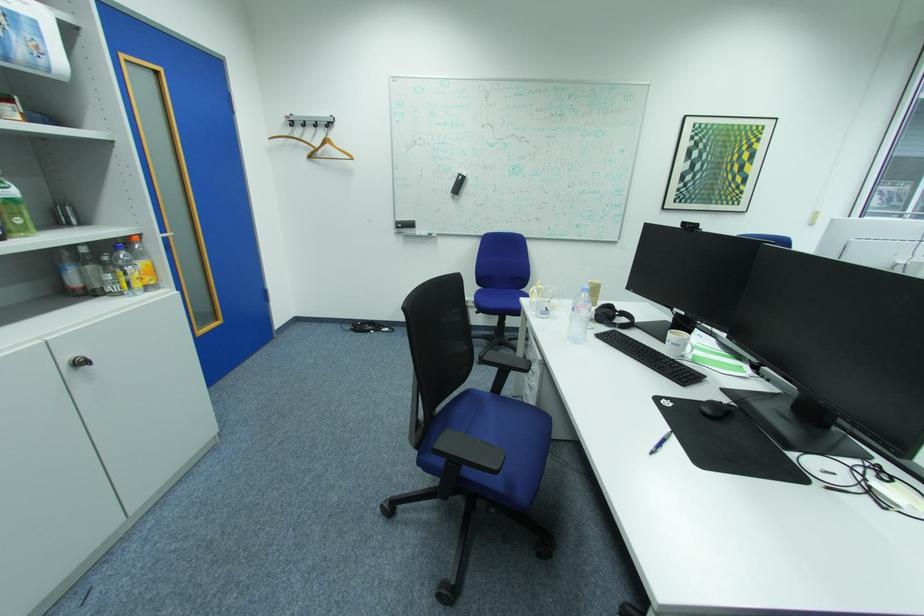
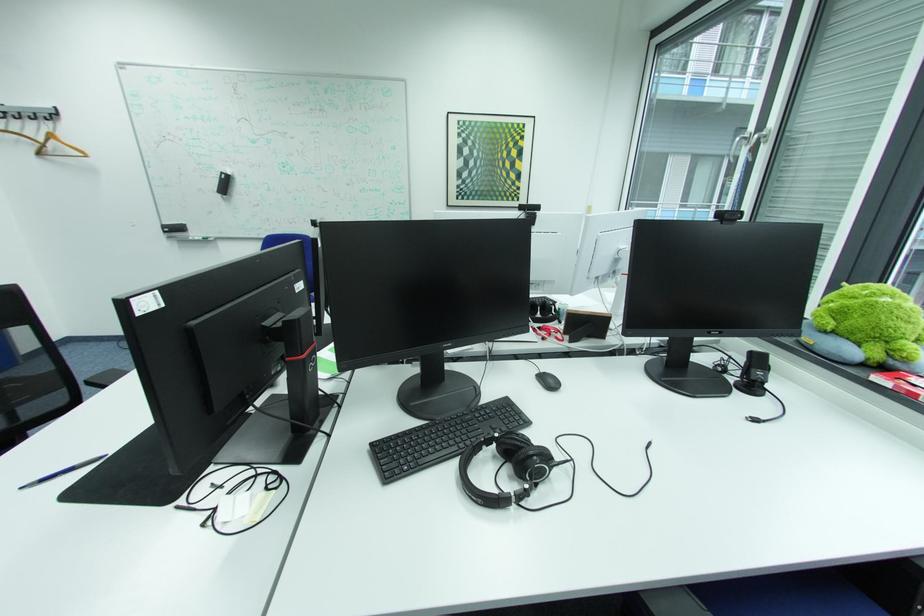
In the second image, find the point that corresponds to (x=611, y=197) in the first image.

(393, 195)